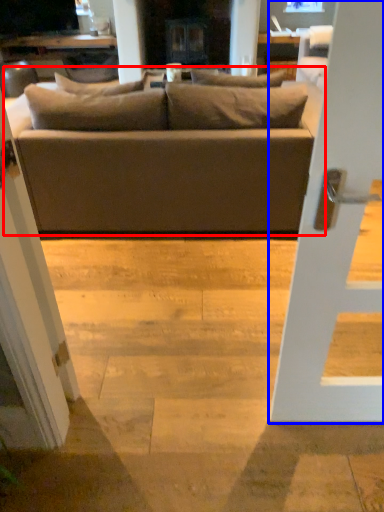
Question: Among these objects, which one is farthest to the camera, studio couch (highlighted by a red box) or door (highlighted by a blue box)?

Choices:
 (A) studio couch
 (B) door

Answer: (A)